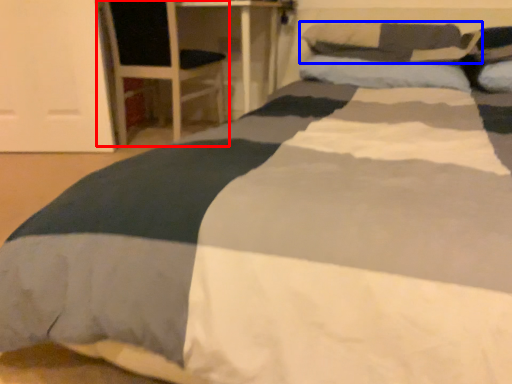
Question: Which of the following is the closest to the observer, armchair (highlighted by a red box) or pillow (highlighted by a blue box)?

Choices:
 (A) armchair
 (B) pillow

Answer: (B)